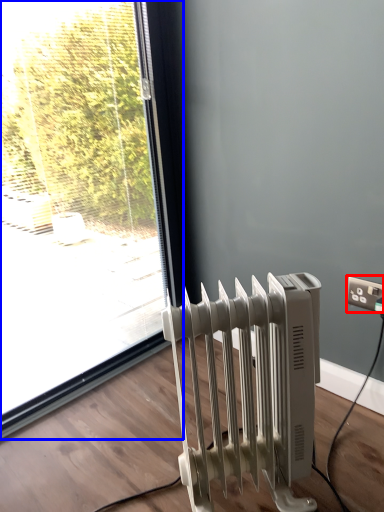
Question: Among these objects, which one is nearest to the camera, electric outlet (highlighted by a red box) or window (highlighted by a blue box)?

Choices:
 (A) electric outlet
 (B) window

Answer: (B)